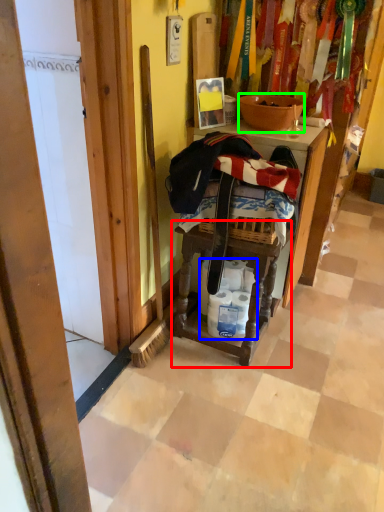
Question: Which object is positioned closest to step stool (highlighted by a red box)? Select from toilet paper (highlighted by a blue box) and bowl (highlighted by a green box).

Choices:
 (A) toilet paper
 (B) bowl

Answer: (A)